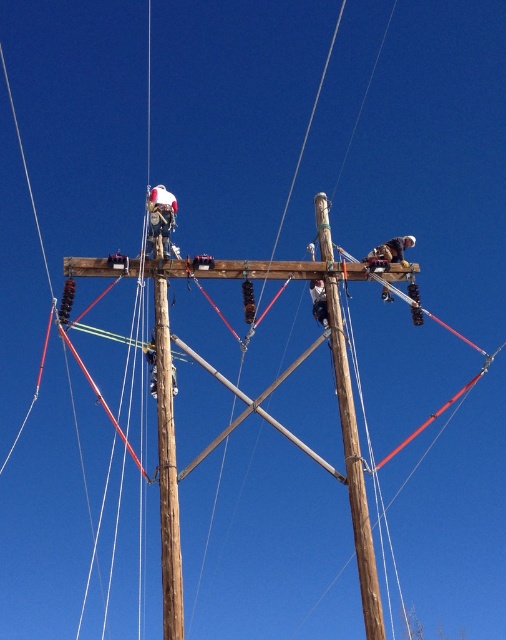
Is the position of brown wooden telegraph pole at center more distant than that of white fabric construction worker at upper left?

No, it is not.

Does brown wooden telegraph pole at center appear on the right side of white fabric construction worker at upper left?

Indeed, brown wooden telegraph pole at center is positioned on the right side of white fabric construction worker at upper left.

Does point (374, 612) come in front of point (174, 212)?

Yes, point (374, 612) is closer to viewer.

Find the location of a particular element. The height and width of the screenshot is (640, 506). brown wooden telegraph pole at center is located at coordinates (350, 435).

Between brown wooden telegraph pole at center and white fabric construction worker at upper right, which one has more height?

With more height is brown wooden telegraph pole at center.

Measure the distance between brown wooden telegraph pole at center and camera.

brown wooden telegraph pole at center and camera are 79.68 meters apart.

The width and height of the screenshot is (506, 640). What are the coordinates of `brown wooden telegraph pole at center` in the screenshot? It's located at (350, 435).

Can you confirm if white fabric construction worker at upper left is bigger than white fabric construction worker at upper right?

Actually, white fabric construction worker at upper left might be smaller than white fabric construction worker at upper right.

Consider the image. Does white fabric construction worker at upper left appear on the left side of white fabric construction worker at upper right?

Yes, white fabric construction worker at upper left is to the left of white fabric construction worker at upper right.

Does point (151, 198) lie behind point (400, 252)?

That is False.

This screenshot has height=640, width=506. In order to click on white fabric construction worker at upper left in this screenshot , I will do `click(160, 218)`.